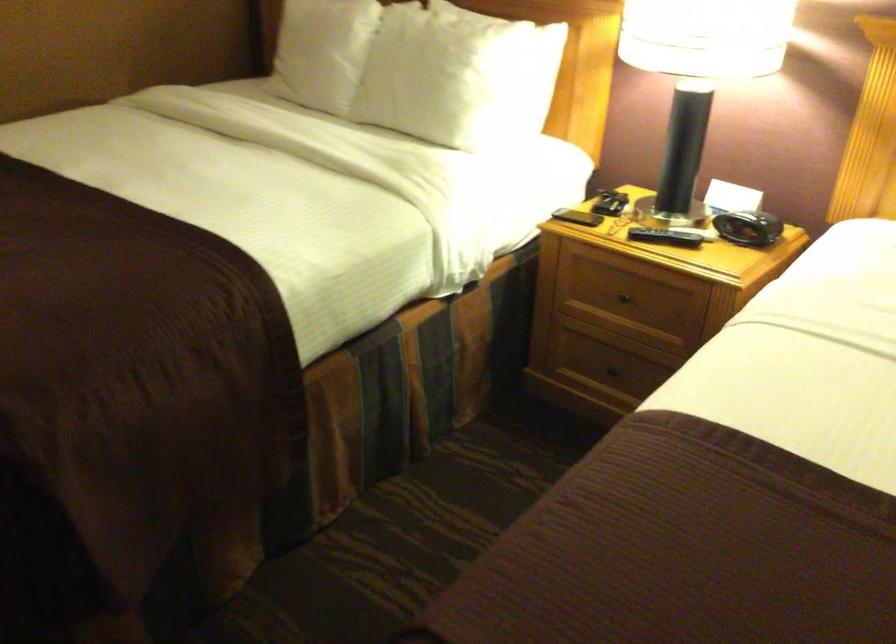
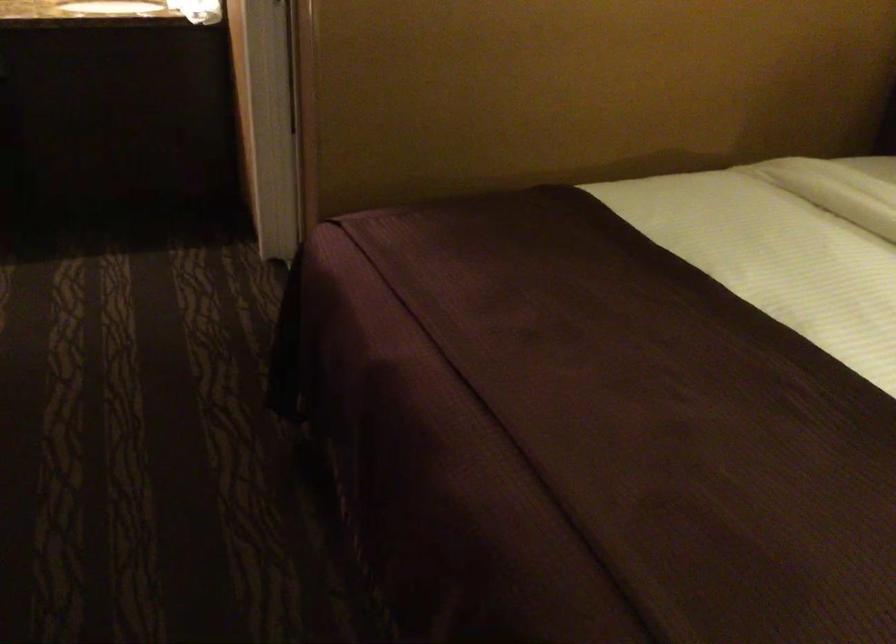
Question: How did the camera likely rotate?

Choices:
 (A) Left
 (B) Right
 (C) Up
 (D) Down

Answer: (A)